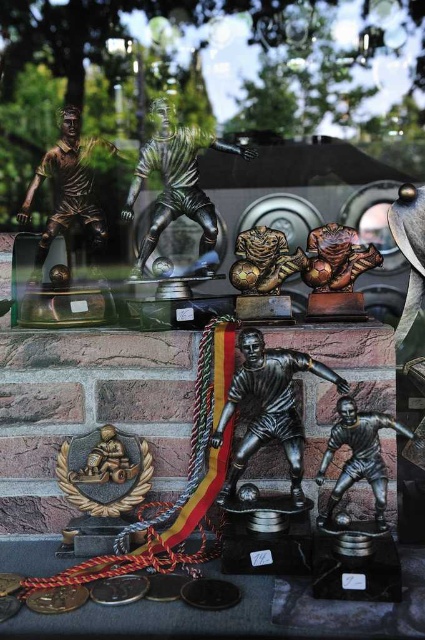
Question: Which is farther from the bronze figure at upper left?

Choices:
 (A) bronze statue of soccer player at center
 (B) bronze/bronze-colored figure at center

Answer: (A)

Question: Does bronze statue of soccer player at center appear over bronze/bronze-colored figure at center?

Choices:
 (A) yes
 (B) no

Answer: (B)

Question: Based on their relative distances, which object is farther from the bronze figure at upper left?

Choices:
 (A) bronze statue of soccer player at center
 (B) bronze/bronze-colored figure at center

Answer: (A)

Question: Is bronze statue of soccer player at center to the right of bronze figure at upper left from the viewer's perspective?

Choices:
 (A) no
 (B) yes

Answer: (B)

Question: Which object is the farthest from the bronze statue of soccer player at center?

Choices:
 (A) bronze/bronze-colored figure at center
 (B) bronze figure at upper left

Answer: (B)

Question: Is bronze/bronze-colored figure at center above bronze figure at upper left?

Choices:
 (A) yes
 (B) no

Answer: (A)